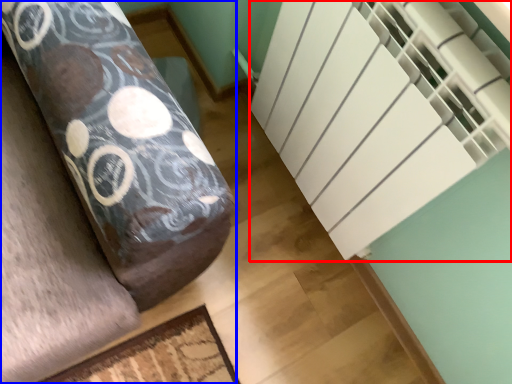
Question: Which of the following is the farthest to the observer, stairwell (highlighted by a red box) or furniture (highlighted by a blue box)?

Choices:
 (A) stairwell
 (B) furniture

Answer: (B)